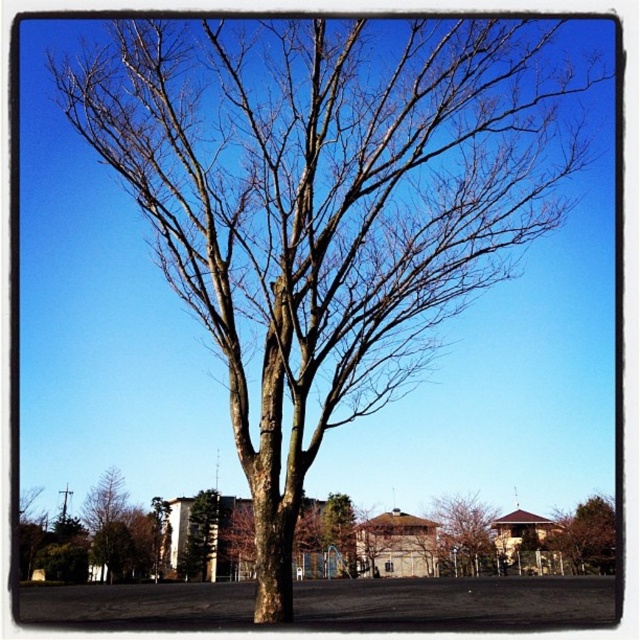
Question: Where is brown rough bark tree at lower right located in relation to brown bark tree at lower left in the image?

Choices:
 (A) below
 (B) above

Answer: (A)

Question: Can you confirm if brown rough bark tree at lower center is thinner than brown rough bark tree at lower right?

Choices:
 (A) no
 (B) yes

Answer: (B)

Question: Is brown rough bark tree at lower right above green leafy tree at center?

Choices:
 (A) yes
 (B) no

Answer: (B)

Question: Which of these objects is positioned farthest from the brown rough bark tree at lower right?

Choices:
 (A) brown rough bark tree at lower center
 (B) brown bark tree at lower left
 (C) green leafy tree at center

Answer: (B)

Question: Among these objects, which one is farthest from the camera?

Choices:
 (A) brown rough bark tree at lower right
 (B) brown bark tree at lower left

Answer: (A)

Question: Among these objects, which one is nearest to the camera?

Choices:
 (A) green leafy tree at center
 (B) brown bark tree at lower left
 (C) brown rough bark tree at lower right
 (D) brown rough bark tree at lower center

Answer: (B)